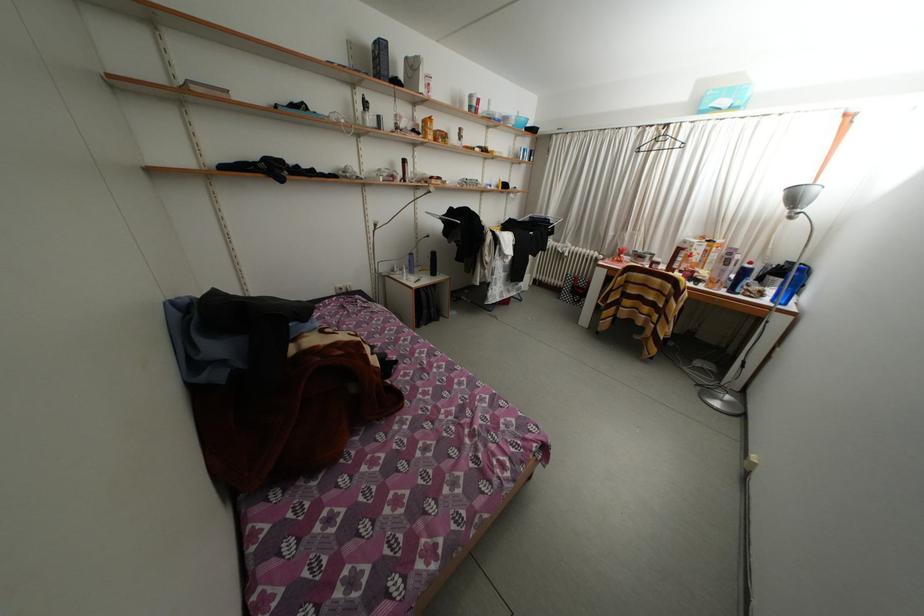
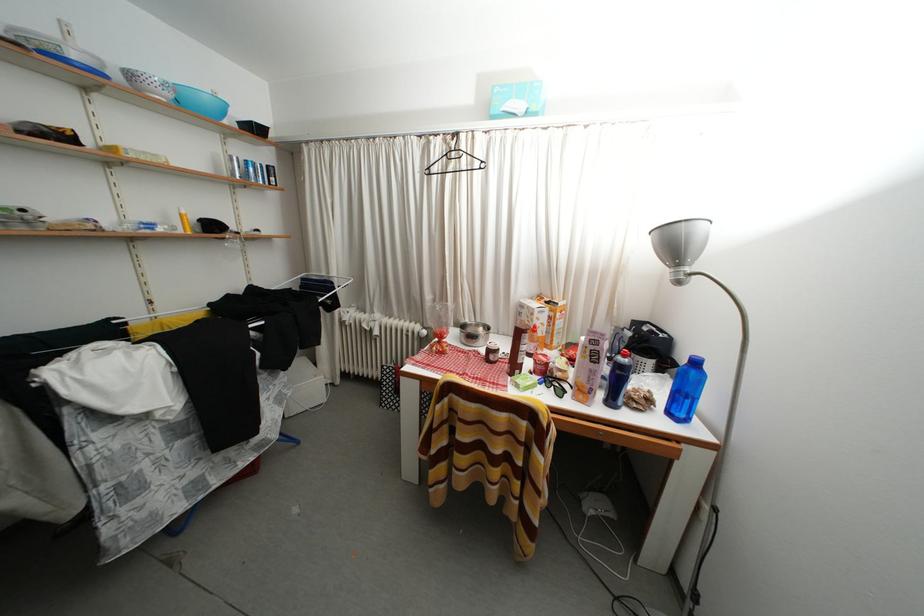
Locate, in the second image, the point that corresponds to (739,296) in the first image.

(618, 408)